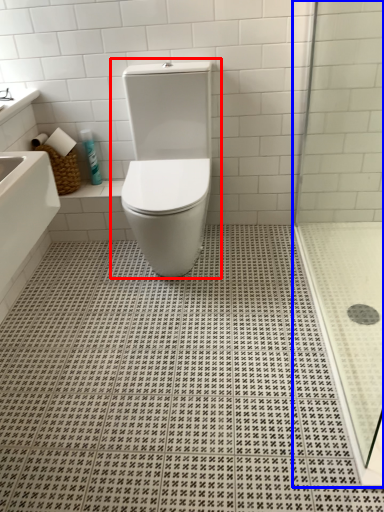
Question: Which point is closer to the camera, toilet (highlighted by a red box) or shower door (highlighted by a blue box)?

Choices:
 (A) toilet
 (B) shower door

Answer: (B)